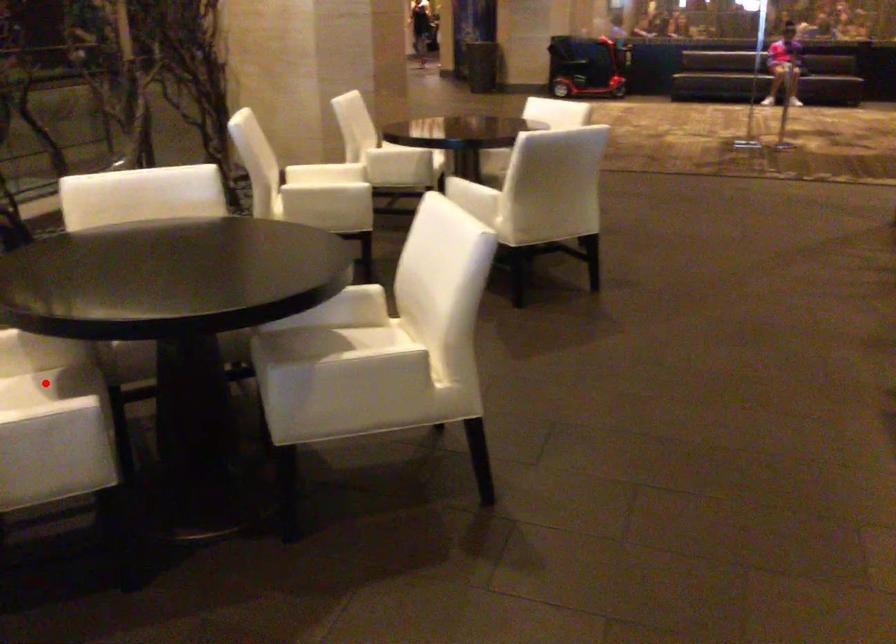
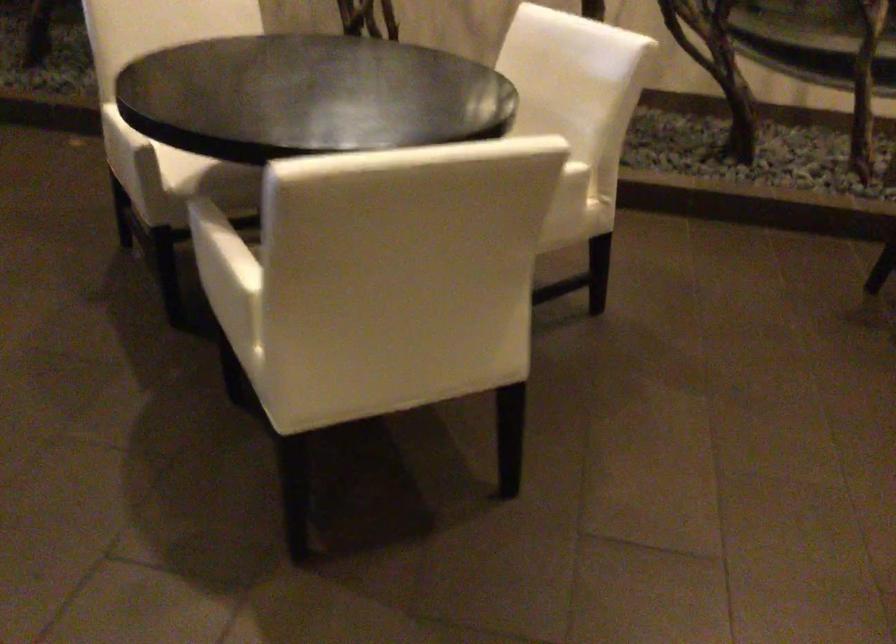
Question: I am providing you with two images of the same scene from different viewpoints. A red point is marked on the first image. At the location where the point appears in image 1, is it still visible in image 2?

Choices:
 (A) Yes
 (B) No

Answer: (B)